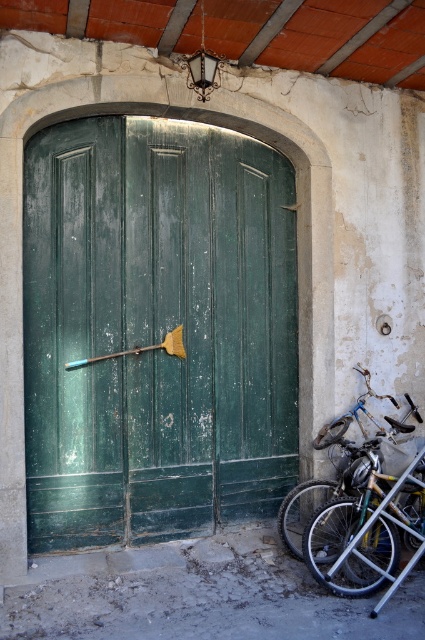
You are standing in front of the green wooden door at center and want to reach the blue metallic bicycle at lower right. Which direction should you move to get closer to the bicycle?

Since the green wooden door at center is closer to the viewer than the blue metallic bicycle at lower right, you should move forward away from the door towards the bicycle to get closer to it.